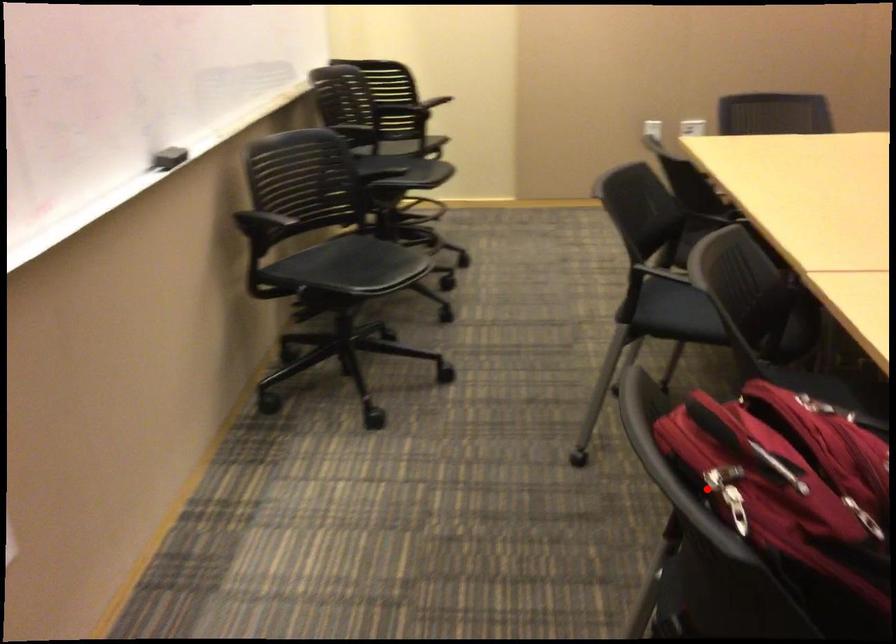
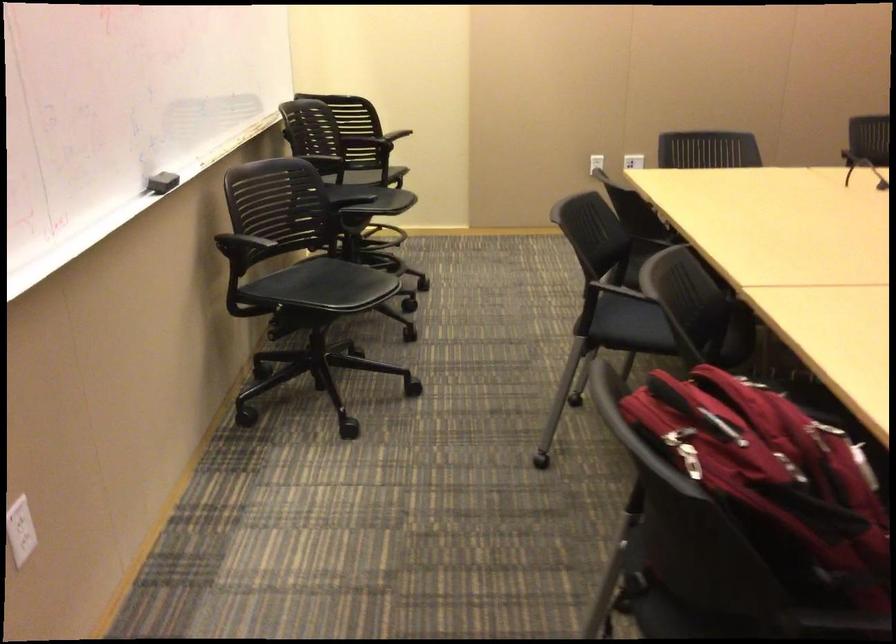
Locate, in the second image, the point that corresponds to the highlighted location in the first image.

(690, 460)